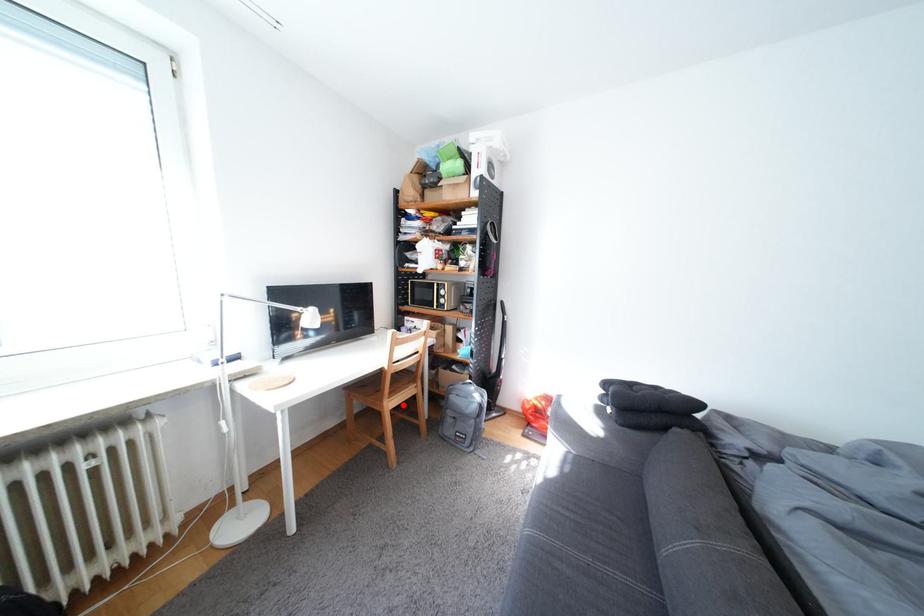
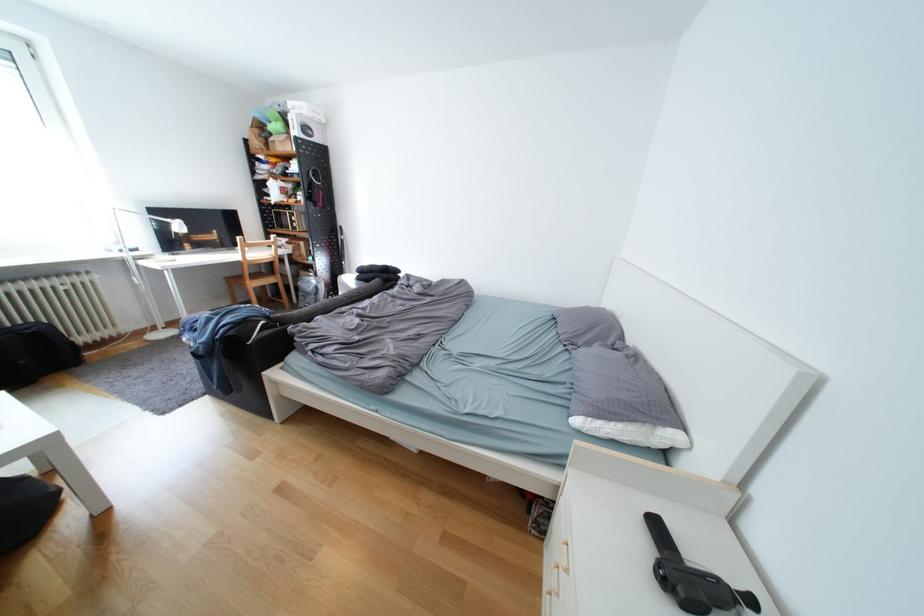
Question: I am providing you with two images of the same scene from different viewpoints. Image1 has a red point marked. In image2, the corresponding 3D location appears at what relative position? Reply with the corresponding letter.

Choices:
 (A) Closer
 (B) Farther

Answer: (A)